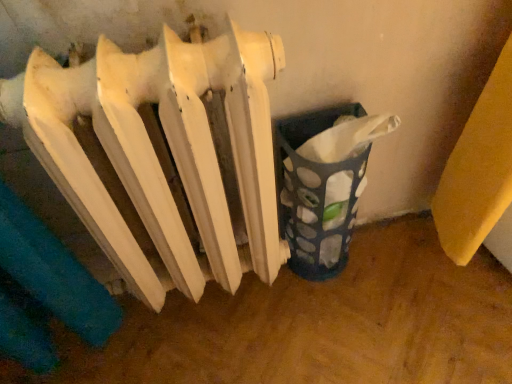
Image resolution: width=512 pixels, height=384 pixels. Identify the location of free spot below white matte radiator at center (from a real-world perspective). tap(209, 311).